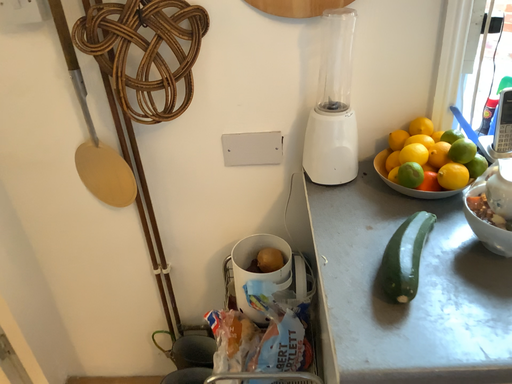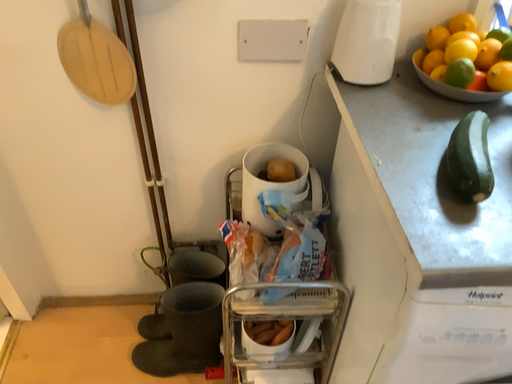
Question: Which way did the camera rotate in the video?

Choices:
 (A) rotated upward
 (B) rotated downward

Answer: (B)